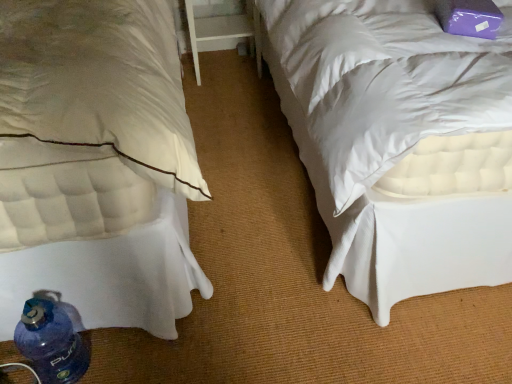
Identify the location of free region under white wood table at center (from a real-world perspective). This screenshot has height=384, width=512. (224, 66).